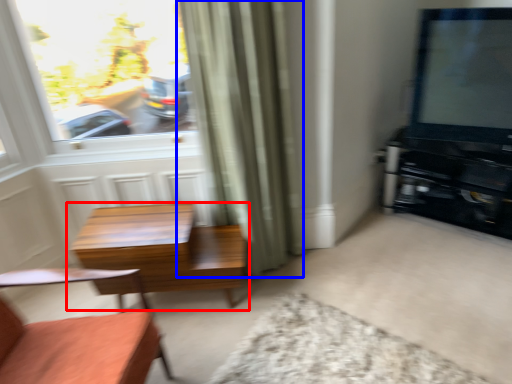
Question: Which object appears closest to the camera in this image, table (highlighted by a red box) or curtain (highlighted by a blue box)?

Choices:
 (A) table
 (B) curtain

Answer: (B)